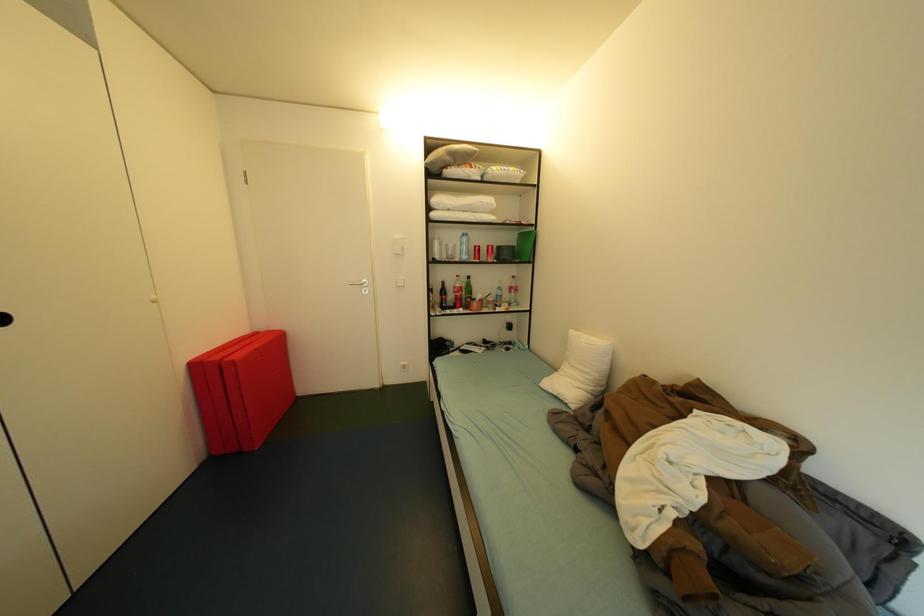
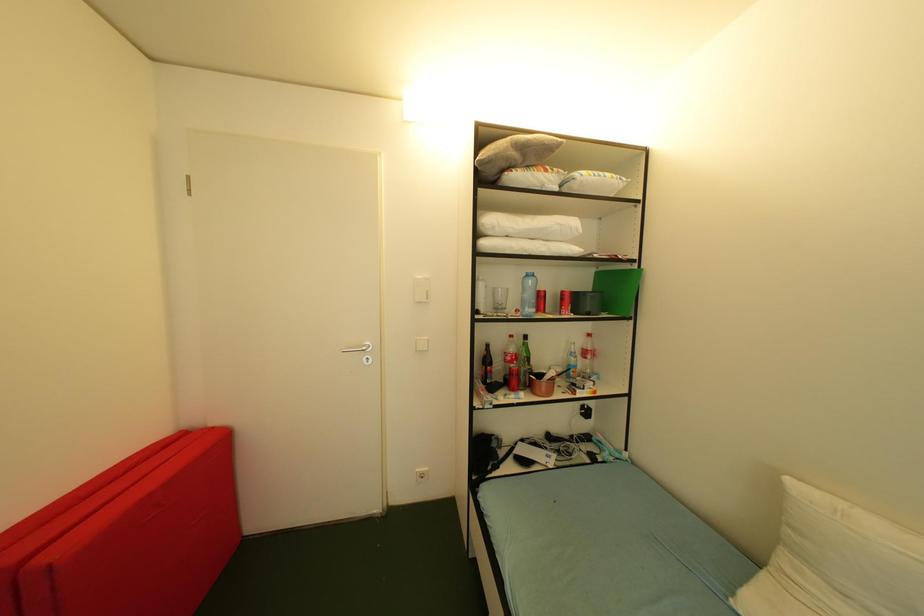
What movement of the cameraman would produce the second image?

The movement direction of the cameraman is left, forward.